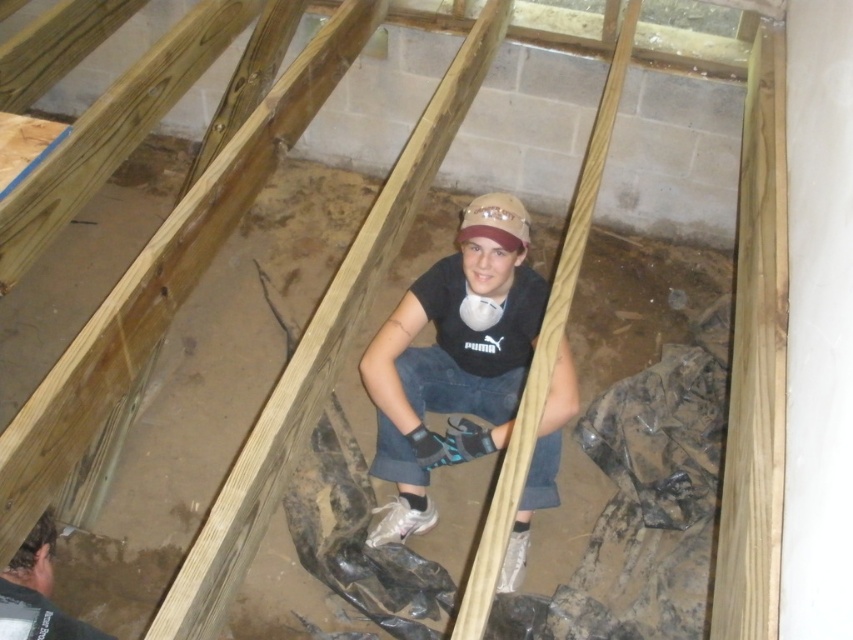
You are a GUI agent. You are given a task and a screenshot of the screen. Output one action in this format:
    pyautogui.click(x=<x>, y=<y>)
    Task: Click on the black matte t-shirt at center
    
    Given the screenshot: What is the action you would take?
    pyautogui.click(x=453, y=358)

Who is more distant from viewer, (448, 308) or (61, 636)?

Point (448, 308)

This screenshot has height=640, width=853. I want to click on black matte t-shirt at center, so click(453, 358).